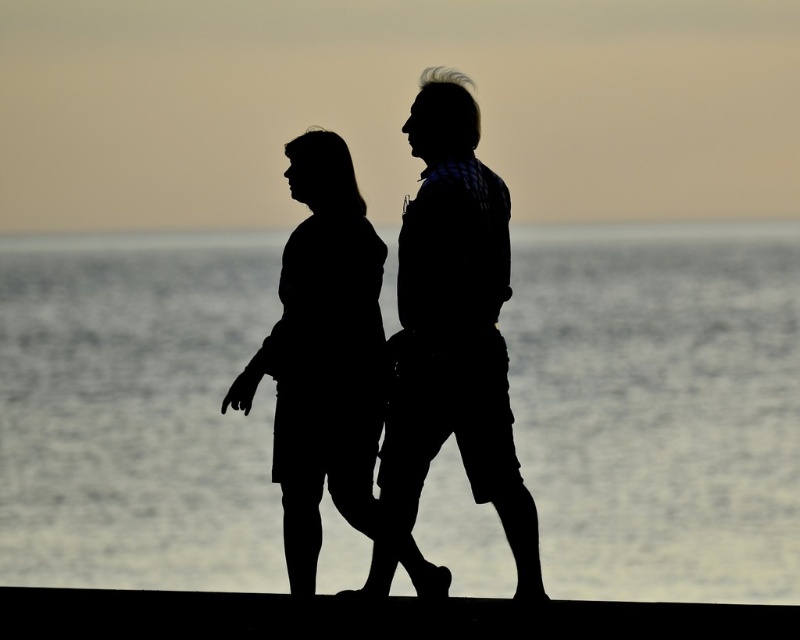
Does point (384, 486) come in front of point (277, 419)?

Yes, point (384, 486) is in front of point (277, 419).

Who is more forward, [536,548] or [306,278]?

Positioned in front is point [536,548].

Locate an element on the screen. This screenshot has width=800, height=640. silhouette shirt at center is located at coordinates (450, 337).

The image size is (800, 640). I want to click on transparent water at center, so click(x=660, y=406).

Based on the photo, does transparent water at center come behind silhouette shirt at center?

No, it is in front of silhouette shirt at center.

I want to click on transparent water at center, so click(660, 406).

The image size is (800, 640). I want to click on transparent water at center, so click(x=660, y=406).

Which is below, transparent water at center or black matte figure at center?

transparent water at center

From the picture: Does transparent water at center come behind black matte figure at center?

Yes, transparent water at center is further from the viewer.

Describe the element at coordinates (660, 406) in the screenshot. I see `transparent water at center` at that location.

Identify the location of transparent water at center. The width and height of the screenshot is (800, 640). (660, 406).